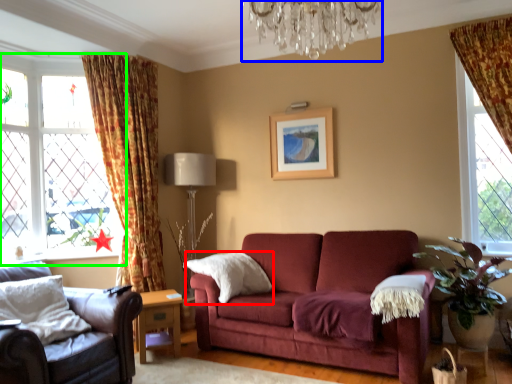
Question: Which is nearer to the pillow (highlighted by a red box)? light fixture (highlighted by a blue box) or window (highlighted by a green box).

Choices:
 (A) light fixture
 (B) window

Answer: (B)